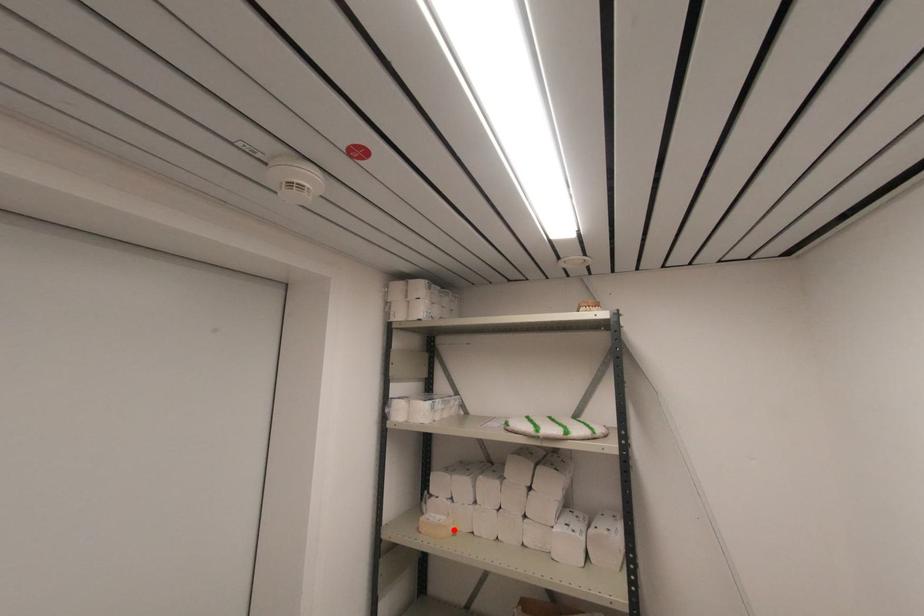
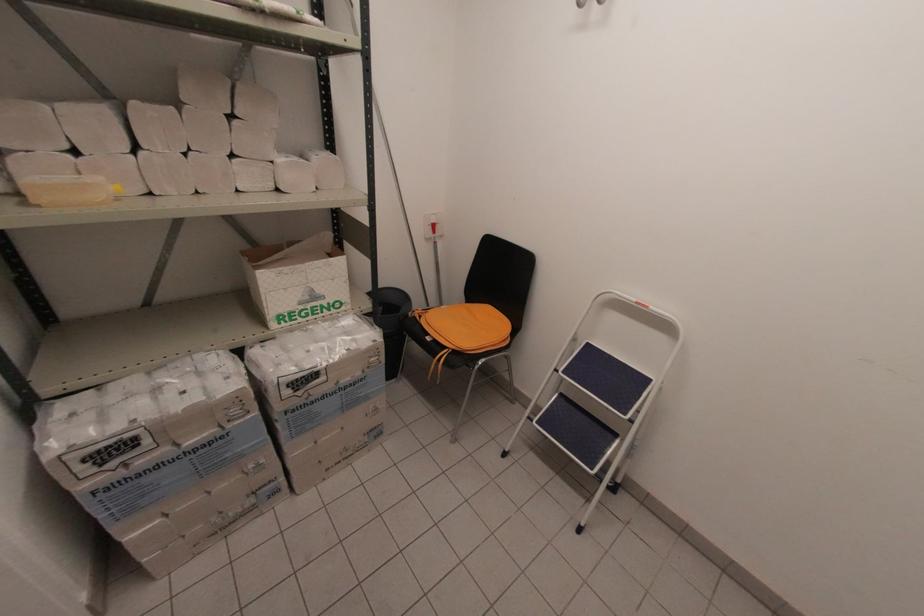
Locate, in the second image, the point that corresponds to the highlighted location in the first image.

(116, 188)